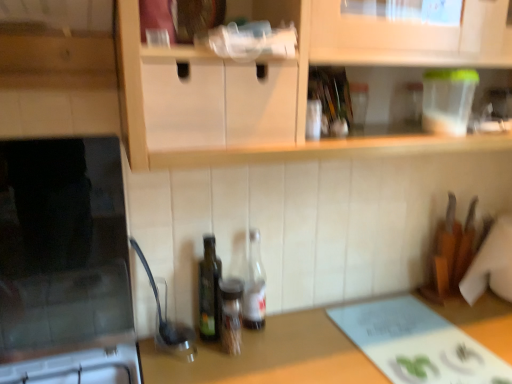
Locate an element on the screen. This screenshot has width=512, height=384. free spot to the right of green glass bottle at center, which is counted as the first bottle, starting from the left is located at coordinates (280, 343).